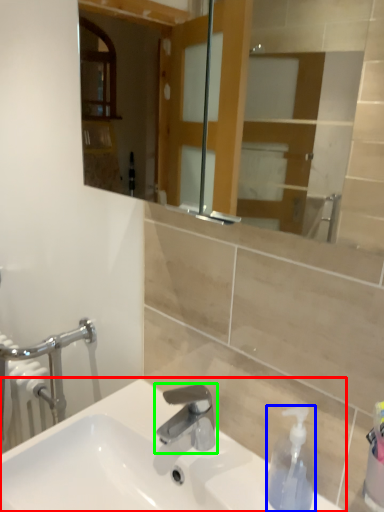
Question: Which is farther away from sink (highlighted by a red box)? soap dispenser (highlighted by a blue box) or tap (highlighted by a green box)?

Choices:
 (A) soap dispenser
 (B) tap

Answer: (A)